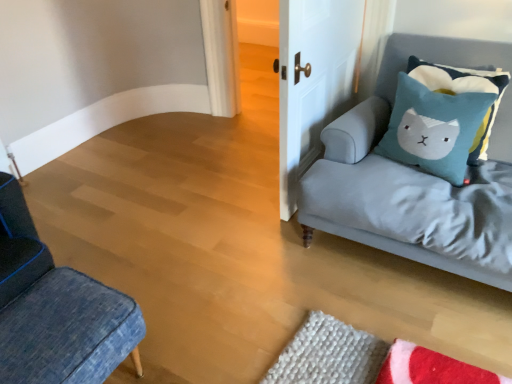
Measure the distance between denim cushion at lower left and camera.

A distance of 1.06 meters exists between denim cushion at lower left and camera.

Find the location of a particular element. This screenshot has width=512, height=384. light gray fabric couch at right is located at coordinates (377, 143).

Measure the distance between point (444, 66) and camera.

Point (444, 66) and camera are 2.03 meters apart.

What is the approximate width of blue felt pillow at upper right, acting as the second pillow starting from the right?

11.22 inches.

I want to click on blue felt pillow at upper right, acting as the second pillow starting from the right, so click(434, 128).

Describe the element at coordinates (313, 80) in the screenshot. The height and width of the screenshot is (384, 512). I see `white matte door at upper center` at that location.

Find the location of a particular element. The image size is (512, 384). denim cushion at lower left is located at coordinates (x=56, y=309).

Are light gray fabric couch at right and teal felt pillow at upper right, which is counted as the first pillow, starting from the right, located far from each other?

light gray fabric couch at right is near teal felt pillow at upper right, which is counted as the first pillow, starting from the right, not far away.

Is light gray fabric couch at right positioned with its back to teal felt pillow at upper right, which is counted as the 2th pillow, starting from the left?

Yes, light gray fabric couch at right is facing away from teal felt pillow at upper right, which is counted as the 2th pillow, starting from the left.

From a real-world perspective, relative to teal felt pillow at upper right, which is counted as the first pillow, starting from the right, is light gray fabric couch at right vertically above or below?

light gray fabric couch at right is below teal felt pillow at upper right, which is counted as the first pillow, starting from the right.

Which object is wider, light gray fabric couch at right or teal felt pillow at upper right, which is counted as the first pillow, starting from the right?

light gray fabric couch at right.

Is denim cushion at lower left inside the boundaries of white matte door at upper center, or outside?

denim cushion at lower left lies outside white matte door at upper center.

From their relative heights in the image, would you say denim cushion at lower left is taller or shorter than white matte door at upper center?

In the image, denim cushion at lower left appears to be shorter than white matte door at upper center.

Are denim cushion at lower left and white matte door at upper center far apart?

That's right, there is a large distance between denim cushion at lower left and white matte door at upper center.

Which is behind, point (298, 169) or point (460, 166)?

The point (298, 169) is behind.

Which is in front, white matte door at upper center or blue felt pillow at upper right, acting as the second pillow starting from the right?

white matte door at upper center is more forward.

In the image, is white matte door at upper center on the left side or the right side of blue felt pillow at upper right, acting as the second pillow starting from the right?

From the image, it's evident that white matte door at upper center is to the left of blue felt pillow at upper right, acting as the second pillow starting from the right.

Is teal felt pillow at upper right, which is counted as the 2th pillow, starting from the left, not near white matte door at upper center?

No, there isn't a large distance between teal felt pillow at upper right, which is counted as the 2th pillow, starting from the left, and white matte door at upper center.

From a real-world perspective, is teal felt pillow at upper right, which is counted as the 2th pillow, starting from the left, above or below white matte door at upper center?

teal felt pillow at upper right, which is counted as the 2th pillow, starting from the left, is situated lower than white matte door at upper center in the real world.

From the image's perspective, is teal felt pillow at upper right, which is counted as the first pillow, starting from the right, located beneath white matte door at upper center?

Yes.

Can we say light gray fabric couch at right lies outside denim cushion at lower left?

light gray fabric couch at right lies outside denim cushion at lower left's area.

Is light gray fabric couch at right wider or thinner than denim cushion at lower left?

In the image, light gray fabric couch at right appears to be wider than denim cushion at lower left.

Considering the sizes of objects light gray fabric couch at right and denim cushion at lower left in the image provided, who is bigger, light gray fabric couch at right or denim cushion at lower left?

light gray fabric couch at right.

Can you tell me how much light gray fabric couch at right and denim cushion at lower left differ in facing direction?

The angular difference between light gray fabric couch at right and denim cushion at lower left is 89.1 degrees.

Between blue felt pillow at upper right, which is counted as the first pillow, starting from the left, and light gray fabric couch at right, which one is positioned in front?

light gray fabric couch at right.

From a real-world perspective, relative to light gray fabric couch at right, is blue felt pillow at upper right, which is counted as the first pillow, starting from the left, vertically above or below?

blue felt pillow at upper right, which is counted as the first pillow, starting from the left, is above light gray fabric couch at right.

From their relative heights in the image, would you say blue felt pillow at upper right, which is counted as the first pillow, starting from the left, is taller or shorter than light gray fabric couch at right?

blue felt pillow at upper right, which is counted as the first pillow, starting from the left, is shorter than light gray fabric couch at right.

Is teal felt pillow at upper right, which is counted as the first pillow, starting from the right, shorter than light gray fabric couch at right?

Indeed, teal felt pillow at upper right, which is counted as the first pillow, starting from the right, has a lesser height compared to light gray fabric couch at right.

Is teal felt pillow at upper right, which is counted as the 2th pillow, starting from the left, wider or thinner than light gray fabric couch at right?

teal felt pillow at upper right, which is counted as the 2th pillow, starting from the left, is thinner than light gray fabric couch at right.

Is teal felt pillow at upper right, which is counted as the first pillow, starting from the right, positioned beyond the bounds of light gray fabric couch at right?

Actually, teal felt pillow at upper right, which is counted as the first pillow, starting from the right, is at least partially inside light gray fabric couch at right.

From the light gray fabric couch at right, count 2nd pillows backward and point to it. Please provide its 2D coordinates.

[(464, 92)]

Identify the location of the 2nd pillow behind the light gray fabric couch at right, starting your count from the anchor. The width and height of the screenshot is (512, 384). (464, 92).

In the image, there is a white matte door at upper center. Identify the location of furniture below it (from a real-world perspective). (56, 309).

Which object lies further to the anchor point denim cushion at lower left, light gray fabric couch at right or blue felt pillow at upper right, acting as the second pillow starting from the right?

The object further to denim cushion at lower left is blue felt pillow at upper right, acting as the second pillow starting from the right.

From the image, which object appears to be farther from light gray fabric couch at right, white matte door at upper center or teal felt pillow at upper right, which is counted as the 2th pillow, starting from the left?

Among the two, white matte door at upper center is located further to light gray fabric couch at right.

Looking at the image, which one is located closer to white matte door at upper center, denim cushion at lower left or blue felt pillow at upper right, acting as the second pillow starting from the right?

blue felt pillow at upper right, acting as the second pillow starting from the right, is closer to white matte door at upper center.

Estimate the real-world distances between objects in this image. Which object is further from light gray fabric couch at right, denim cushion at lower left or blue felt pillow at upper right, which is counted as the first pillow, starting from the left?

denim cushion at lower left.

Looking at the image, which one is located closer to teal felt pillow at upper right, which is counted as the 2th pillow, starting from the left, denim cushion at lower left or white matte door at upper center?

white matte door at upper center is closer to teal felt pillow at upper right, which is counted as the 2th pillow, starting from the left.

Considering their positions, is light gray fabric couch at right positioned further to white matte door at upper center than teal felt pillow at upper right, which is counted as the first pillow, starting from the right?

Among the two, teal felt pillow at upper right, which is counted as the first pillow, starting from the right, is located further to white matte door at upper center.

Which object lies further to the anchor point denim cushion at lower left, blue felt pillow at upper right, acting as the second pillow starting from the right, or light gray fabric couch at right?

The object further to denim cushion at lower left is blue felt pillow at upper right, acting as the second pillow starting from the right.

When comparing their distances from white matte door at upper center, does teal felt pillow at upper right, which is counted as the first pillow, starting from the right, or blue felt pillow at upper right, acting as the second pillow starting from the right, seem closer?

blue felt pillow at upper right, acting as the second pillow starting from the right.

Image resolution: width=512 pixels, height=384 pixels. Find the location of `studio couch located between denim cushion at lower left and teal felt pillow at upper right, which is counted as the first pillow, starting from the right, in the left-right direction`. studio couch located between denim cushion at lower left and teal felt pillow at upper right, which is counted as the first pillow, starting from the right, in the left-right direction is located at coordinates (377, 143).

Where is `door situated between denim cushion at lower left and light gray fabric couch at right from left to right`? door situated between denim cushion at lower left and light gray fabric couch at right from left to right is located at coordinates (313, 80).

This screenshot has width=512, height=384. Find the location of `studio couch between denim cushion at lower left and blue felt pillow at upper right, which is counted as the first pillow, starting from the left, from left to right`. studio couch between denim cushion at lower left and blue felt pillow at upper right, which is counted as the first pillow, starting from the left, from left to right is located at coordinates (377, 143).

I want to click on studio couch located between white matte door at upper center and blue felt pillow at upper right, acting as the second pillow starting from the right, in the left-right direction, so click(x=377, y=143).